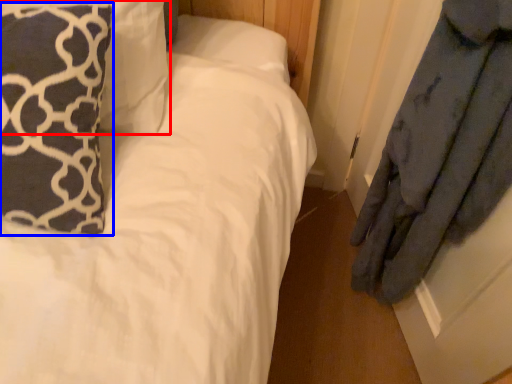
Question: Which point is closer to the camera, pillow (highlighted by a red box) or pillow (highlighted by a blue box)?

Choices:
 (A) pillow
 (B) pillow

Answer: (B)